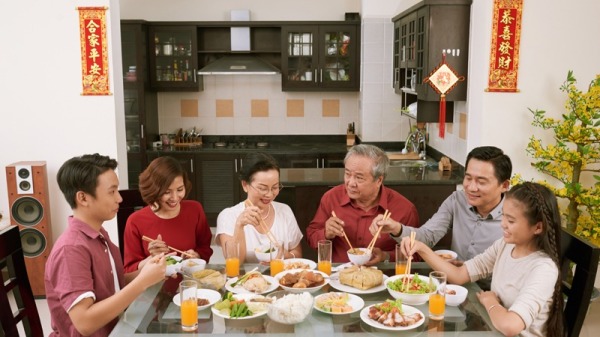
Find the location of `wall hanging`. wall hanging is located at coordinates (84, 40), (506, 49), (443, 77).